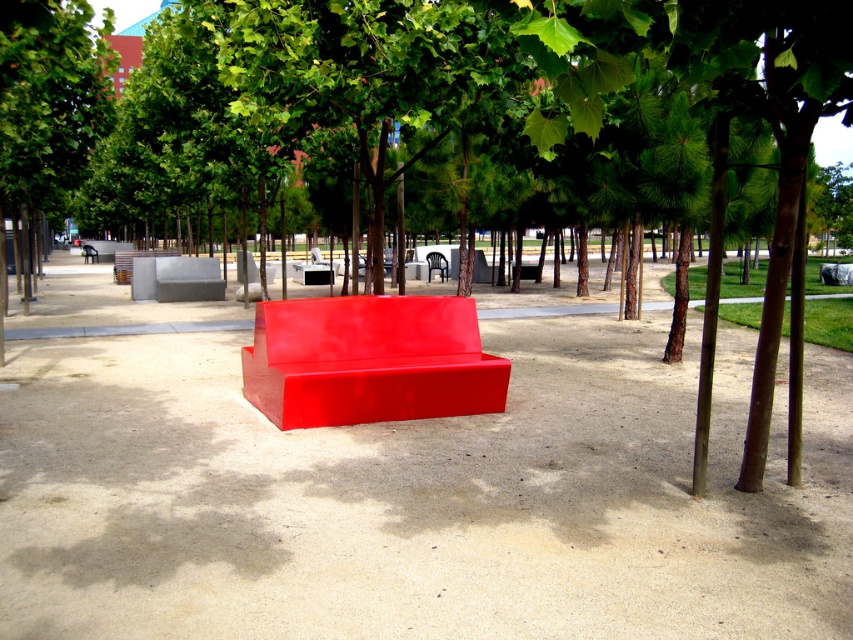
Can you confirm if matte gray bench at center is positioned below black plastic chair at center?

No, matte gray bench at center is not below black plastic chair at center.

Who is shorter, matte gray bench at center or black plastic chair at center?

black plastic chair at center

Find the location of `matte gray bench at center`. matte gray bench at center is located at coordinates (131, 260).

Does point (415, 337) lie behind point (161, 252)?

No, it is in front of (161, 252).

Can you confirm if glossy red bench at center is bigger than matte gray bench at center?

No, glossy red bench at center is not bigger than matte gray bench at center.

Find the location of a particular element. The image size is (853, 640). glossy red bench at center is located at coordinates (369, 360).

At what (x,y) coordinates should I click in order to perform the action: click on glossy red bench at center. Please return your answer as a coordinate pair (x, y). Looking at the image, I should click on (369, 360).

Between glossy red bench at center and black plastic chair at center, which one appears on the right side from the viewer's perspective?

From the viewer's perspective, black plastic chair at center appears more on the right side.

This screenshot has width=853, height=640. What do you see at coordinates (369, 360) in the screenshot? I see `glossy red bench at center` at bounding box center [369, 360].

Where is `glossy red bench at center`? glossy red bench at center is located at coordinates (369, 360).